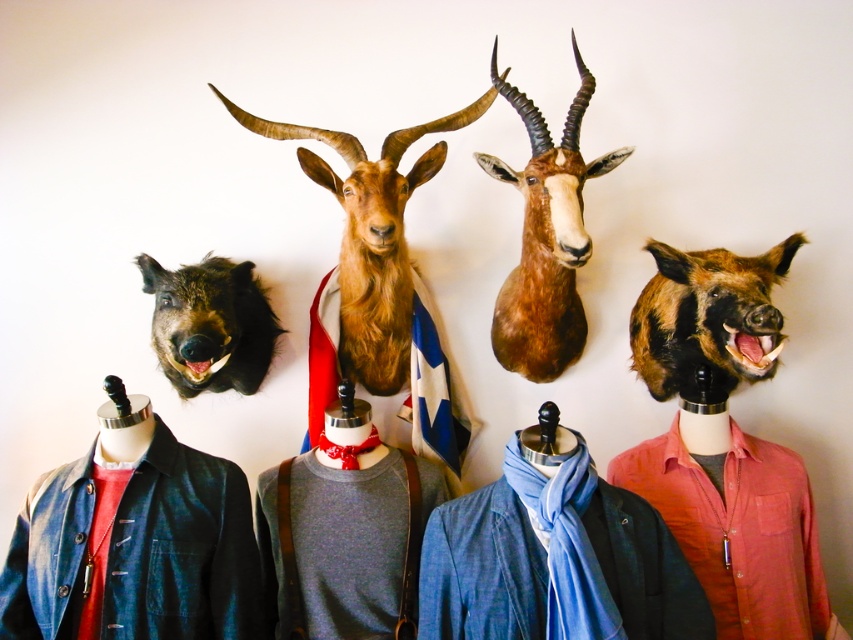
Question: Which point is closer to the camera taking this photo?

Choices:
 (A) (523, 456)
 (B) (548, 630)

Answer: (B)

Question: Is matte brown pig head at center positioned behind brown matte goat head at center?

Choices:
 (A) yes
 (B) no

Answer: (A)

Question: Is matte brown pig head at center behind brown matte goat head at center?

Choices:
 (A) no
 (B) yes

Answer: (B)

Question: Among these points, which one is farthest from the camera?

Choices:
 (A) (160, 605)
 (B) (538, 428)
 (C) (757, 481)

Answer: (C)

Question: Which object is the closest to the blue denim jacket at lower center?

Choices:
 (A) denim jacket at lower left
 (B) brown matte goat head at center

Answer: (A)

Question: Can you confirm if denim jacket at lower left is positioned to the right of brown furry goat at center?

Choices:
 (A) no
 (B) yes

Answer: (A)